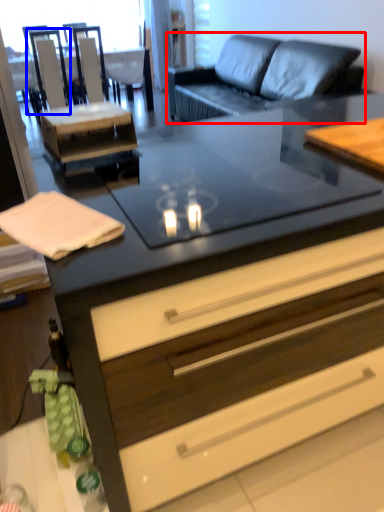
Question: Which point is further to the camera, studio couch (highlighted by a red box) or armchair (highlighted by a blue box)?

Choices:
 (A) studio couch
 (B) armchair

Answer: (B)